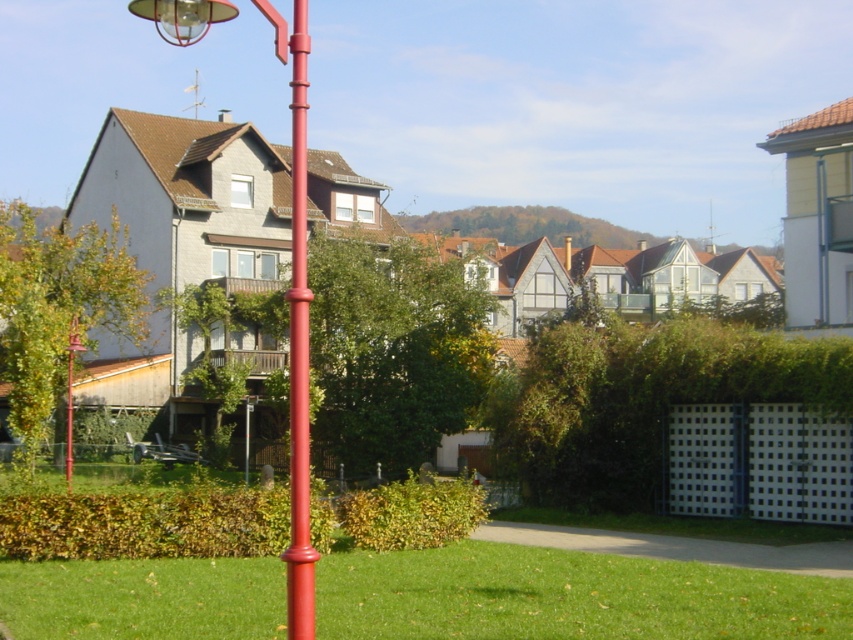
Can you confirm if metallic red pole at center is positioned below smooth glossy red pole at center?

No, metallic red pole at center is not below smooth glossy red pole at center.

Between point (296, 410) and point (305, 180), which one is positioned in front?

Point (296, 410) is more forward.

Is point (305, 531) positioned behind point (289, 403)?

No, it is not.

Find the location of a particular element. metallic red pole at center is located at coordinates (297, 328).